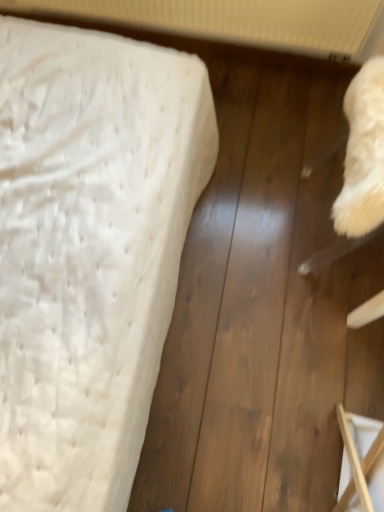
Locate an element on the screen. Image resolution: width=384 pixels, height=512 pixels. free space to the back side of wooden frame at lower right is located at coordinates (335, 371).